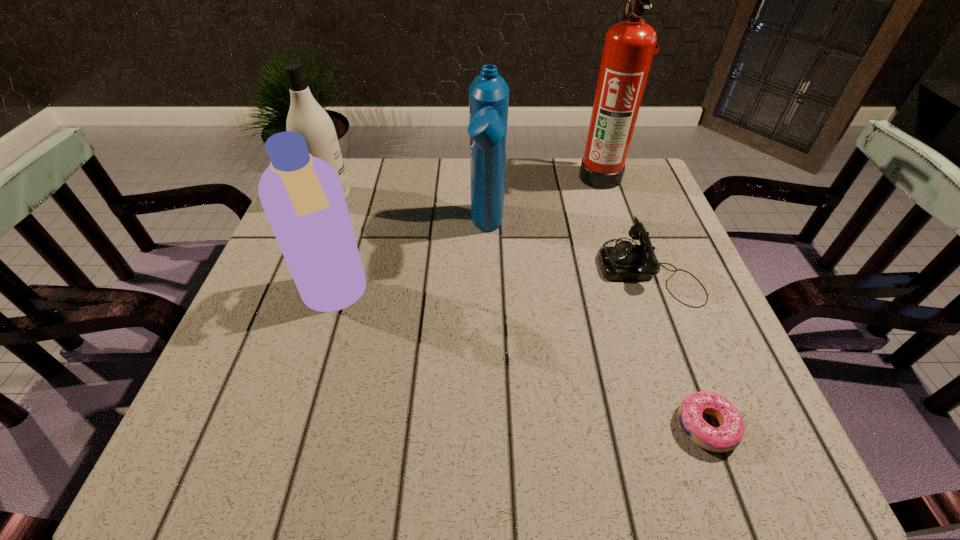
Find the location of `object situated at the far left corner`. object situated at the far left corner is located at coordinates (306, 117).

Identify the location of object at the far right corner. The height and width of the screenshot is (540, 960). (629, 46).

You are a GUI agent. You are given a task and a screenshot of the screen. Output one action in this format:
    pyautogui.click(x=<x>, y=<y>)
    Task: Click on the object that is at the near right corner
    The width and height of the screenshot is (960, 540).
    Given the screenshot: What is the action you would take?
    pyautogui.click(x=728, y=436)

At what (x,y) coordinates should I click in order to perform the action: click on vacant space at the far edge of the desktop. Please return your answer as a coordinate pair (x, y). The height and width of the screenshot is (540, 960). Looking at the image, I should click on (562, 198).

In the image, there is a desktop. At what (x,y) coordinates should I click in order to perform the action: click on free region at the left edge. Please return your answer as a coordinate pair (x, y). Image resolution: width=960 pixels, height=540 pixels. Looking at the image, I should click on (211, 381).

You are a GUI agent. You are given a task and a screenshot of the screen. Output one action in this format:
    pyautogui.click(x=<x>, y=<y>)
    Task: Click on the free space at the right edge of the desktop
    
    Given the screenshot: What is the action you would take?
    pyautogui.click(x=608, y=214)

In the image, there is a desktop. Where is `vacant space at the far right corner`? vacant space at the far right corner is located at coordinates (650, 190).

You are a GUI agent. You are given a task and a screenshot of the screen. Output one action in this format:
    pyautogui.click(x=<x>, y=<y>)
    Task: Click on the free space between the fire extinguisher and the doughnut
    This screenshot has width=960, height=540.
    Given the screenshot: What is the action you would take?
    pyautogui.click(x=654, y=301)

The height and width of the screenshot is (540, 960). In order to click on blank region between the nearest object and the rightmost shampoo in this screenshot , I will do `click(597, 328)`.

This screenshot has width=960, height=540. What are the coordinates of `vacant space that's between the fourth object from right to left and the fire extinguisher` in the screenshot? It's located at (544, 203).